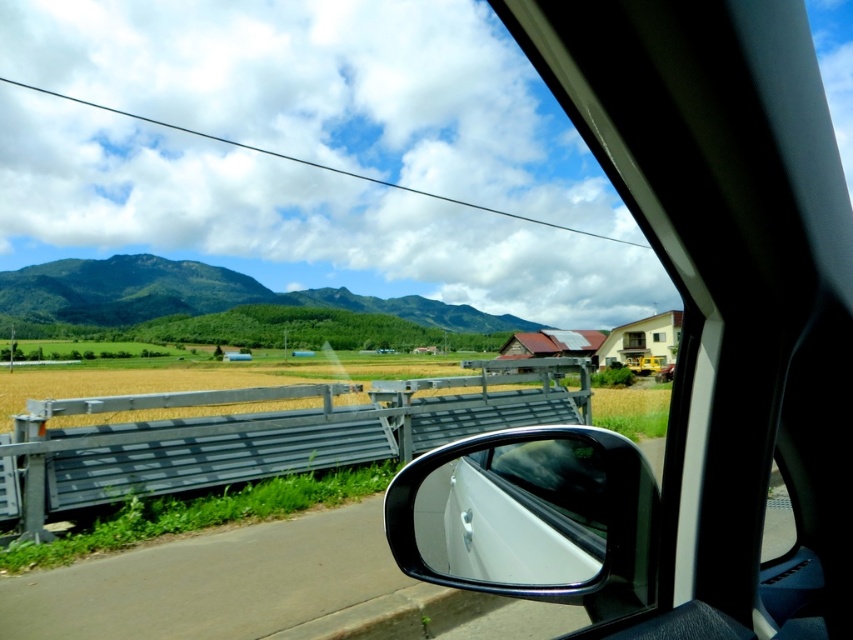
Question: Which of the following is the farthest from the observer?

Choices:
 (A) black glossy side mirror at center
 (B) green forested mountain at left

Answer: (B)

Question: Is black glossy side mirror at center thinner than green forested mountain at left?

Choices:
 (A) yes
 (B) no

Answer: (A)

Question: From the image, what is the correct spatial relationship of black glossy side mirror at center in relation to green forested mountain at left?

Choices:
 (A) right
 (B) left

Answer: (A)

Question: Which point is farther from the camera taking this photo?

Choices:
 (A) (572, 429)
 (B) (183, 284)

Answer: (B)

Question: In this image, where is black glossy side mirror at center located relative to green forested mountain at left?

Choices:
 (A) below
 (B) above

Answer: (A)